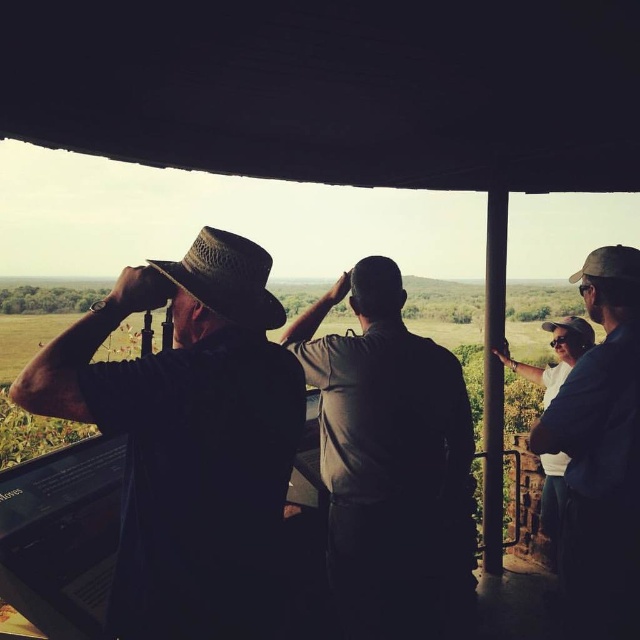
Question: Is dark brown uniform at center positioned behind white cotton shirt at right?

Choices:
 (A) yes
 (B) no

Answer: (B)

Question: Does straw hat at left come behind dark blue shirt at right?

Choices:
 (A) no
 (B) yes

Answer: (A)

Question: Which of the following is the farthest from the observer?

Choices:
 (A) straw hat at left
 (B) white cotton shirt at right
 (C) dark blue shirt at right

Answer: (B)

Question: In this image, where is dark brown uniform at center located relative to white cotton shirt at right?

Choices:
 (A) below
 (B) above

Answer: (A)

Question: Based on their relative distances, which object is farther from the dark brown uniform at center?

Choices:
 (A) straw hat at left
 (B) white cotton shirt at right
 (C) dark blue shirt at right

Answer: (B)

Question: Which point is farther from the camera taking this photo?

Choices:
 (A) (461, 529)
 (B) (561, 324)

Answer: (B)